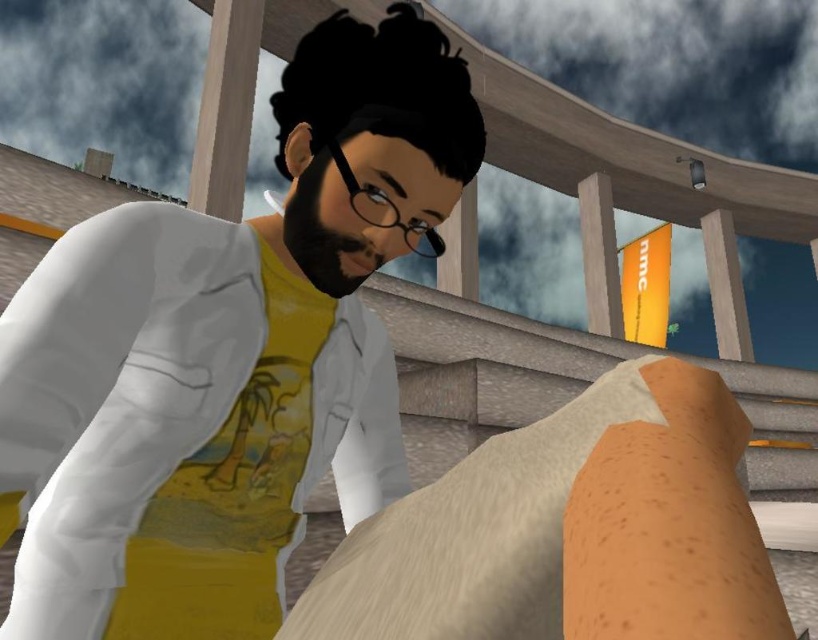
Question: Which point is closer to the camera?

Choices:
 (A) click(619, 307)
 (B) click(133, 604)
 (C) click(210, 90)

Answer: (B)

Question: Can you confirm if white matte lab coat at center is wider than wooden post at upper center?

Choices:
 (A) yes
 (B) no

Answer: (B)

Question: Does white matte lab coat at center have a greater width compared to wooden at upper center?

Choices:
 (A) no
 (B) yes

Answer: (A)

Question: Which object is closer to the camera taking this photo?

Choices:
 (A) wooden at upper center
 (B) smooth gray pillar at upper right
 (C) white matte lab coat at center
 (D) wooden post at upper center

Answer: (C)

Question: Considering the relative positions of wooden post at upper center and wooden at upper center in the image provided, where is wooden post at upper center located with respect to wooden at upper center?

Choices:
 (A) right
 (B) left

Answer: (B)

Question: Which object is the farthest from the wooden post at upper center?

Choices:
 (A) smooth gray pillar at upper right
 (B) white matte lab coat at center

Answer: (A)